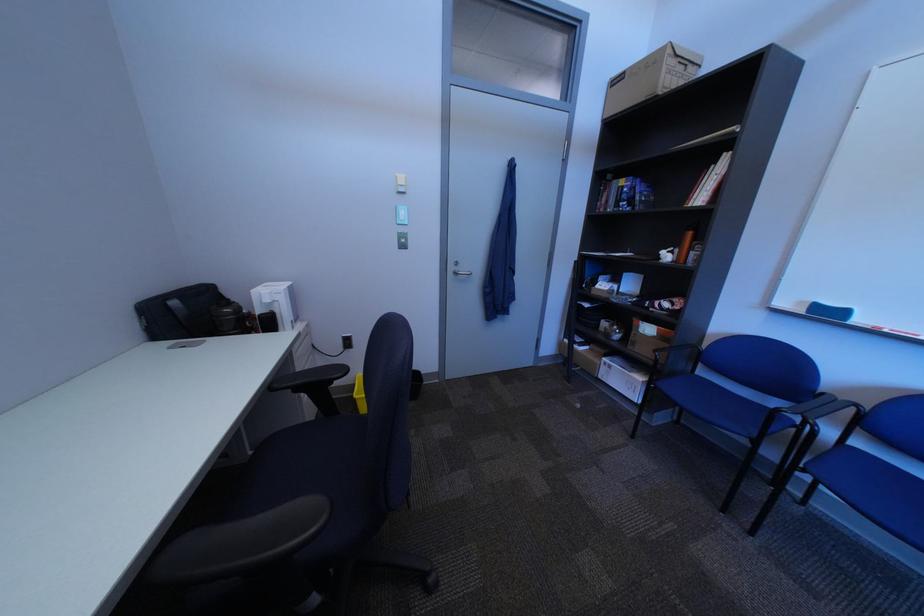
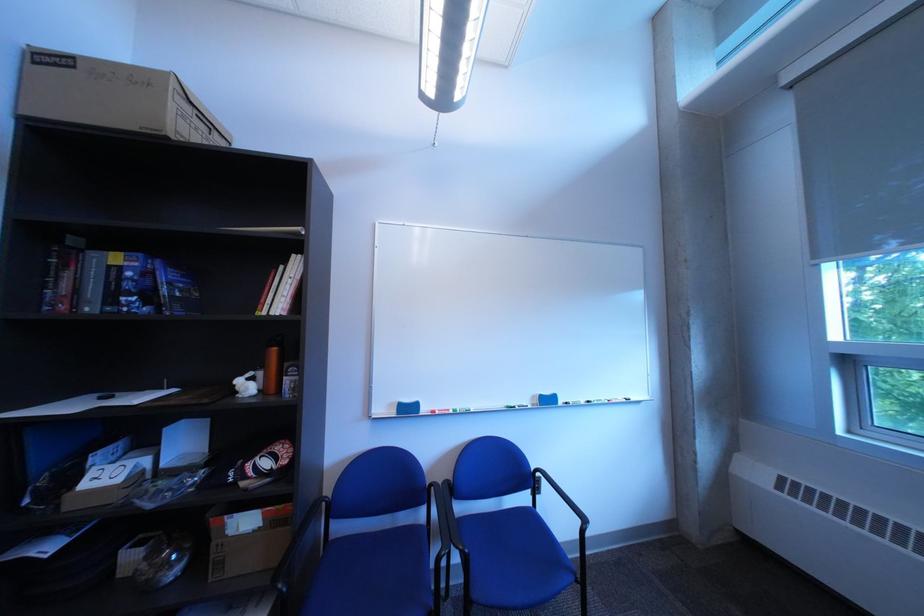
Locate, in the second image, the point that corresponds to point 650,345 in the first image.

(237, 565)